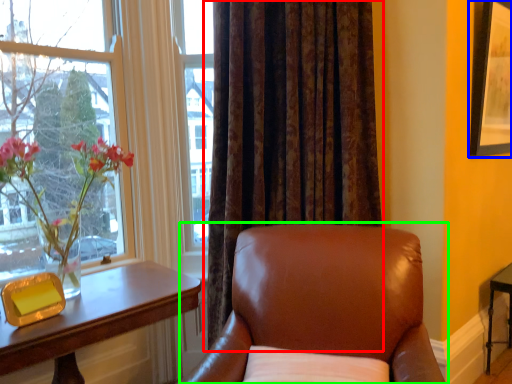
Question: Considering the real-world distances, which object is farthest from curtain (highlighted by a red box)? picture frame (highlighted by a blue box) or chair (highlighted by a green box)?

Choices:
 (A) picture frame
 (B) chair

Answer: (A)